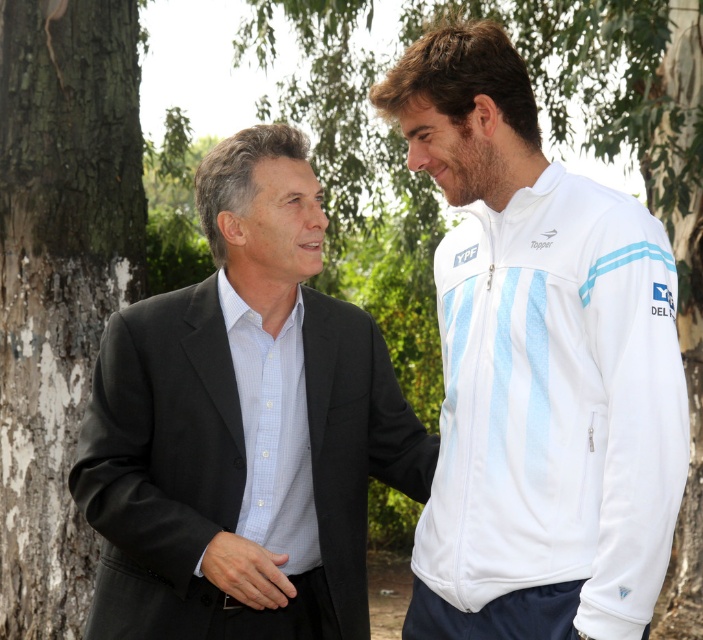
Between point (572, 436) and point (285, 602), which one is positioned in front?

Positioned in front is point (572, 436).

Who is higher up, white fabric jacket at right or smooth skin hand at center?

white fabric jacket at right

Who is more distant from viewer, [445,408] or [217,570]?

The point [445,408] is behind.

Where is `white fabric jacket at right`? Image resolution: width=703 pixels, height=640 pixels. white fabric jacket at right is located at coordinates (536, 369).

Is point (477, 339) behind point (34, 308)?

No, (477, 339) is closer to viewer.

Is point (581, 291) closer to viewer compared to point (77, 54)?

That is True.

Identify the location of white fabric jacket at right. This screenshot has height=640, width=703. (536, 369).

Is rough bark tree at left below smooth skin hand at center?

No, rough bark tree at left is not below smooth skin hand at center.

This screenshot has width=703, height=640. What do you see at coordinates (58, 280) in the screenshot?
I see `rough bark tree at left` at bounding box center [58, 280].

In order to click on rough bark tree at left in this screenshot , I will do `click(58, 280)`.